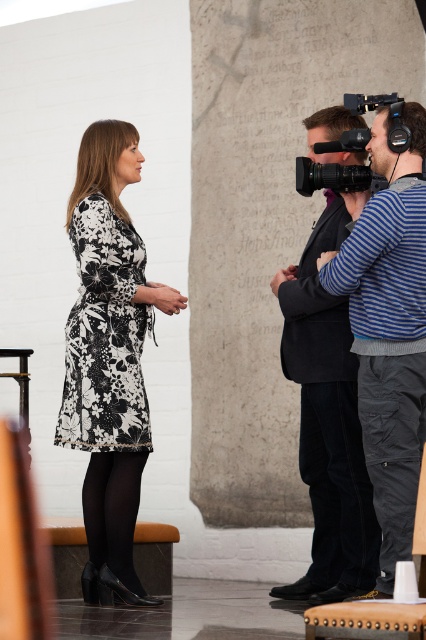
Question: Can you confirm if black floral dress at left is positioned to the right of black floral dress at center?

Choices:
 (A) no
 (B) yes

Answer: (B)

Question: Which object is farther from the camera taking this photo?

Choices:
 (A) black floral dress at left
 (B) black plastic video camera at right

Answer: (A)

Question: Is blue striped sweater at right in front of dark gray suit at right?

Choices:
 (A) no
 (B) yes

Answer: (B)

Question: Among these points, which one is farthest from the camera?

Choices:
 (A) (55, 435)
 (B) (350, 410)
 (C) (299, 179)
 (D) (389, 488)

Answer: (C)

Question: Does dark gray suit at right have a larger size compared to black floral dress at center?

Choices:
 (A) no
 (B) yes

Answer: (B)

Question: Among these objects, which one is nearest to the camera?

Choices:
 (A) black plastic video camera at right
 (B) dark gray suit at right
 (C) black floral dress at left

Answer: (A)